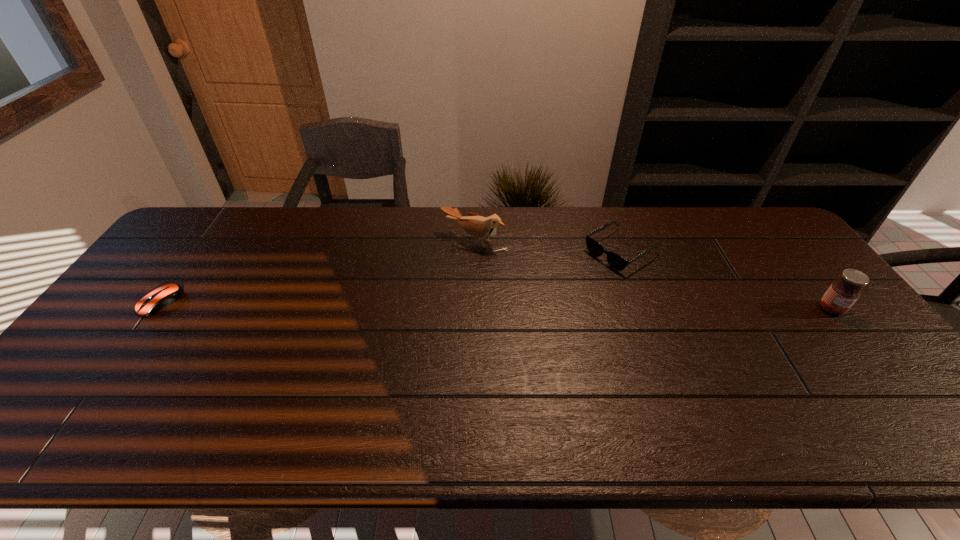
This screenshot has width=960, height=540. Find the location of `free space located 0.210m at the beak of the bird`. free space located 0.210m at the beak of the bird is located at coordinates (420, 294).

You are a GUI agent. You are given a task and a screenshot of the screen. Output one action in this format:
    pyautogui.click(x=<x>, y=<y>)
    Task: Click on the vacant position located at the front lenses of the sunglasses
    
    Given the screenshot: What is the action you would take?
    pyautogui.click(x=578, y=276)

The height and width of the screenshot is (540, 960). In order to click on vacant region located 0.320m at the front lenses of the sunglasses in this screenshot , I will do `click(517, 313)`.

Where is `free space located 0.200m at the front lenses of the sunglasses`? The width and height of the screenshot is (960, 540). free space located 0.200m at the front lenses of the sunglasses is located at coordinates (549, 294).

The image size is (960, 540). What are the coordinates of `bird located at the far edge` in the screenshot? It's located at (480, 227).

Locate an element on the screen. This screenshot has width=960, height=540. sunglasses at the far edge is located at coordinates (616, 261).

In order to click on object that is at the left edge in this screenshot , I will do `click(165, 295)`.

Find the location of `object at the right edge`. object at the right edge is located at coordinates (842, 294).

This screenshot has height=540, width=960. In the image, there is a desktop. In order to click on vacant space at the far edge in this screenshot , I will do `click(252, 210)`.

Identify the location of blank area at the near edge. This screenshot has height=540, width=960. (403, 381).